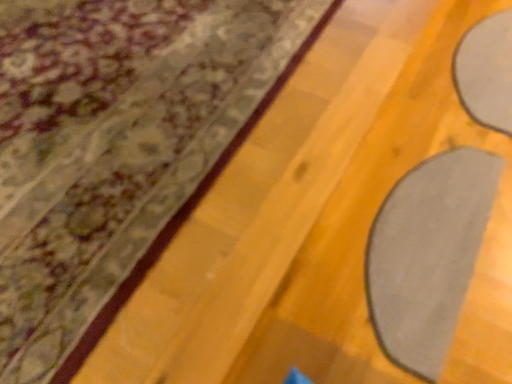
Question: Is gray matte yoga mat at lower right oriented towards matte gray curtain at upper right?

Choices:
 (A) yes
 (B) no

Answer: (B)

Question: From the image's perspective, is gray matte yoga mat at lower right located beneath matte gray curtain at upper right?

Choices:
 (A) yes
 (B) no

Answer: (A)

Question: From a real-world perspective, is gray matte yoga mat at lower right over matte gray curtain at upper right?

Choices:
 (A) yes
 (B) no

Answer: (B)

Question: Considering the relative sizes of gray matte yoga mat at lower right and matte gray curtain at upper right in the image provided, is gray matte yoga mat at lower right bigger than matte gray curtain at upper right?

Choices:
 (A) no
 (B) yes

Answer: (A)

Question: Is gray matte yoga mat at lower right positioned with its back to matte gray curtain at upper right?

Choices:
 (A) no
 (B) yes

Answer: (A)

Question: Is gray matte yoga mat at lower right thinner than matte gray curtain at upper right?

Choices:
 (A) yes
 (B) no

Answer: (A)

Question: Would you say matte gray curtain at upper right contains gray matte yoga mat at lower right?

Choices:
 (A) yes
 (B) no

Answer: (B)

Question: Considering the relative sizes of matte gray curtain at upper right and gray matte yoga mat at lower right in the image provided, is matte gray curtain at upper right shorter than gray matte yoga mat at lower right?

Choices:
 (A) no
 (B) yes

Answer: (B)

Question: From the image's perspective, is matte gray curtain at upper right below gray matte yoga mat at lower right?

Choices:
 (A) yes
 (B) no

Answer: (B)

Question: Considering the relative positions of matte gray curtain at upper right and gray matte yoga mat at lower right in the image provided, is matte gray curtain at upper right to the left of gray matte yoga mat at lower right from the viewer's perspective?

Choices:
 (A) no
 (B) yes

Answer: (B)

Question: Is there a large distance between matte gray curtain at upper right and gray matte yoga mat at lower right?

Choices:
 (A) yes
 (B) no

Answer: (B)

Question: From the image's perspective, does matte gray curtain at upper right appear higher than gray matte yoga mat at lower right?

Choices:
 (A) yes
 (B) no

Answer: (A)

Question: Is gray matte yoga mat at lower right inside the boundaries of matte gray curtain at upper right, or outside?

Choices:
 (A) inside
 (B) outside

Answer: (B)